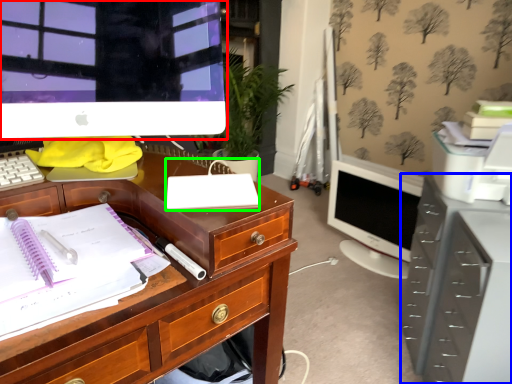
Question: Which is nearer to the computer monitor (highlighted by a red box)? file cabinet (highlighted by a blue box) or office supplies (highlighted by a green box).

Choices:
 (A) file cabinet
 (B) office supplies

Answer: (B)